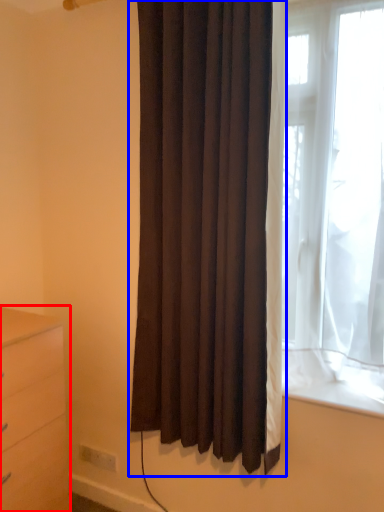
Question: Which of the following is the closest to the observer, chest of drawers (highlighted by a red box) or curtain (highlighted by a blue box)?

Choices:
 (A) chest of drawers
 (B) curtain

Answer: (B)